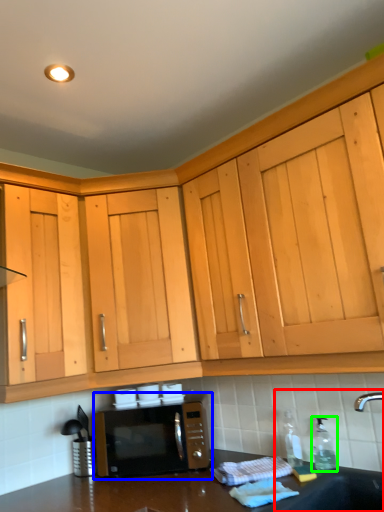
Question: Which object is positioned closest to sink (highlighted by a red box)? Select from microwave oven (highlighted by a blue box) and bottle (highlighted by a green box).

Choices:
 (A) microwave oven
 (B) bottle

Answer: (B)